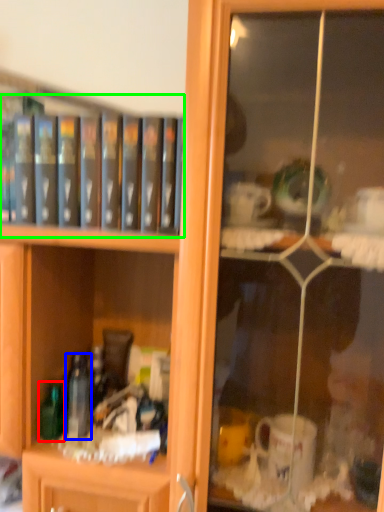
Question: Which is nearer to the bottle (highlighted by a red box)? bottle (highlighted by a blue box) or book (highlighted by a green box).

Choices:
 (A) bottle
 (B) book

Answer: (A)